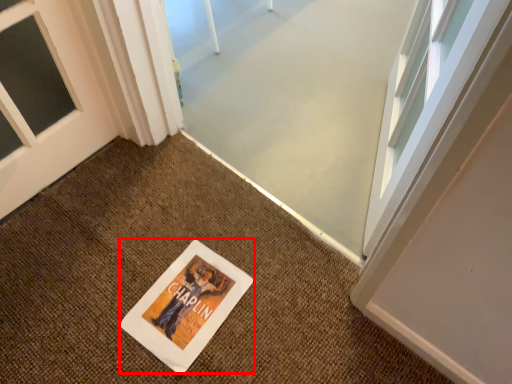
Question: In this image, where is flyer (annotated by the red box) located relative to doormat?

Choices:
 (A) right
 (B) left

Answer: (B)